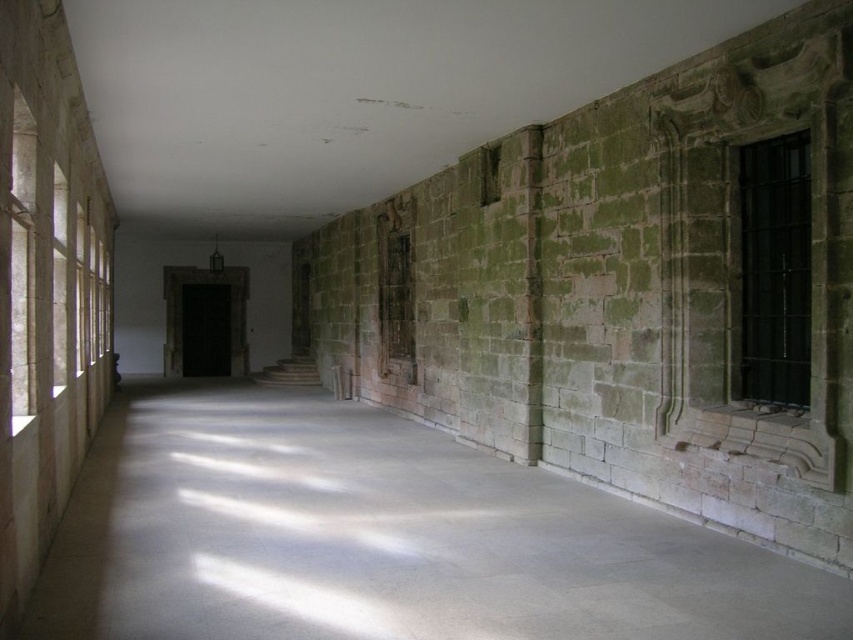
Question: Is smooth concrete floor at center to the left of black metal window at right from the viewer's perspective?

Choices:
 (A) yes
 (B) no

Answer: (A)

Question: Does smooth concrete floor at center come behind black metal window at right?

Choices:
 (A) no
 (B) yes

Answer: (A)

Question: Is smooth concrete floor at center behind black metal window at right?

Choices:
 (A) yes
 (B) no

Answer: (B)

Question: Which point is closer to the camera taking this photo?

Choices:
 (A) (804, 403)
 (B) (257, 609)

Answer: (B)